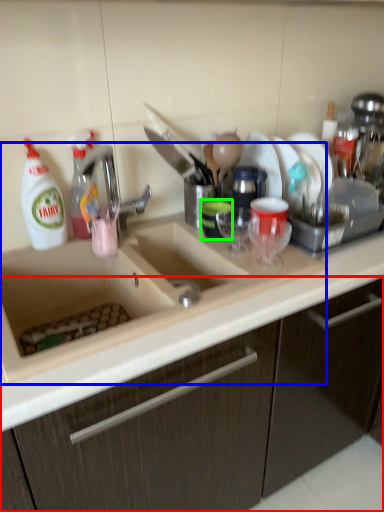
Question: Based on their relative distances, which object is nearer to cabinetry (highlighted by a red box)? Choose from sink (highlighted by a blue box) and tableware (highlighted by a green box).

Choices:
 (A) sink
 (B) tableware

Answer: (A)